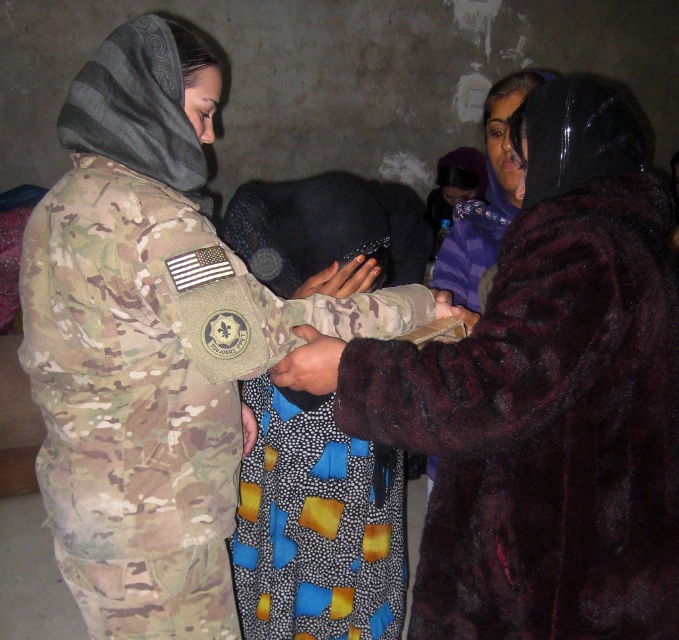
Is camouflage uniform at left further to the viewer compared to textured fabric hand at center?

No, it is not.

Which of these two, camouflage uniform at left or textured fabric hand at center, stands shorter?

With less height is textured fabric hand at center.

Between point (230, 444) and point (249, 422), which one is positioned in front?

Positioned in front is point (230, 444).

You are a GUI agent. You are given a task and a screenshot of the screen. Output one action in this format:
    pyautogui.click(x=<x>, y=<y>)
    Task: Click on the camouflage uniform at left
    
    Given the screenshot: What is the action you would take?
    pyautogui.click(x=151, y=346)

Who is lower down, purple striped scarf at upper center or textured fabric hand at center?

textured fabric hand at center is below.

Is point (449, 276) closer to camera compared to point (242, 435)?

That is False.

Who is more forward, (496, 88) or (244, 445)?

Positioned in front is point (244, 445).

Find the location of a particular element. This screenshot has width=679, height=640. purple striped scarf at upper center is located at coordinates (485, 196).

This screenshot has width=679, height=640. What are the coordinates of `velvet maroon coat at right` in the screenshot? It's located at (549, 400).

Does velvet maroon coat at right appear under camouflage uniform at left?

Yes, velvet maroon coat at right is below camouflage uniform at left.

The image size is (679, 640). In order to click on velvet maroon coat at right in this screenshot , I will do (x=549, y=400).